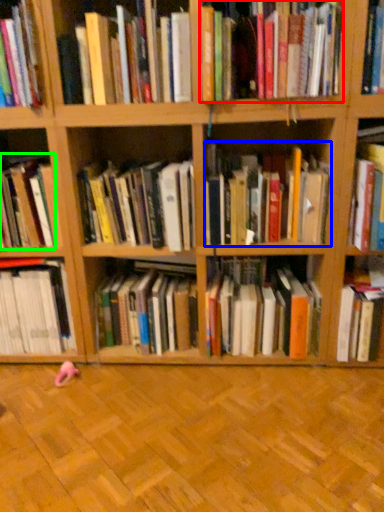
Question: Considering the real-world distances, which object is closest to book (highlighted by a red box)? book (highlighted by a blue box) or book (highlighted by a green box).

Choices:
 (A) book
 (B) book

Answer: (A)